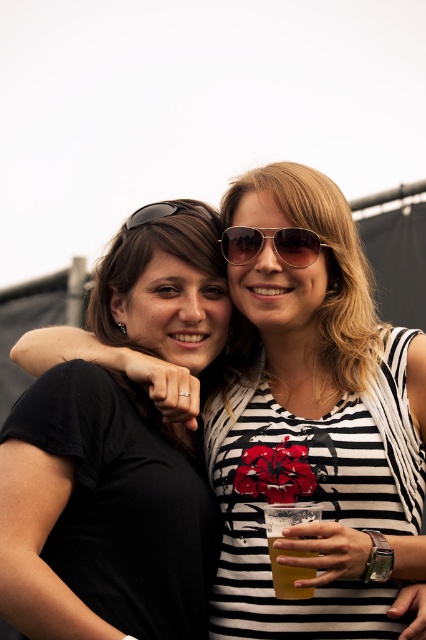
In the scene shown: You are taking a photo of the gold metallic aviator sunglasses at center. Where exactly should you point your camera to capture it?

You should point your camera to the coordinates at point (273, 244) to capture the gold metallic aviator sunglasses at center.